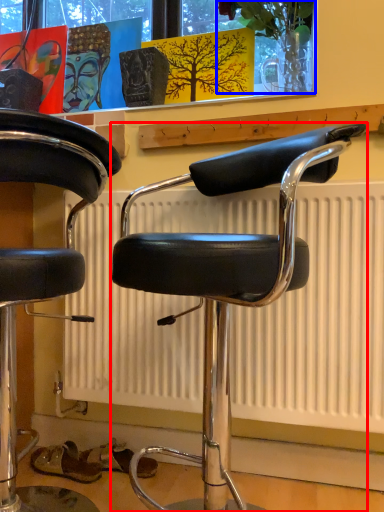
Question: Which of the following is the closest to the observer, chair (highlighted by a red box) or plant (highlighted by a blue box)?

Choices:
 (A) chair
 (B) plant

Answer: (A)